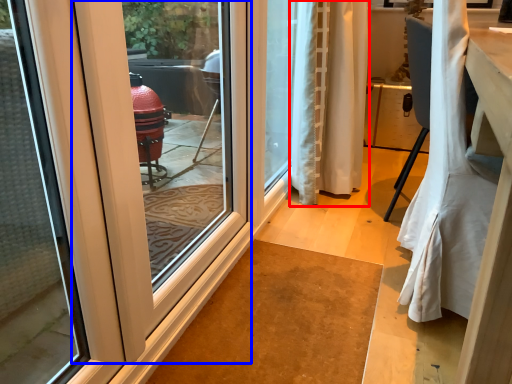
Question: Which of the following is the farthest to the observer, curtain (highlighted by a red box) or door (highlighted by a blue box)?

Choices:
 (A) curtain
 (B) door

Answer: (A)